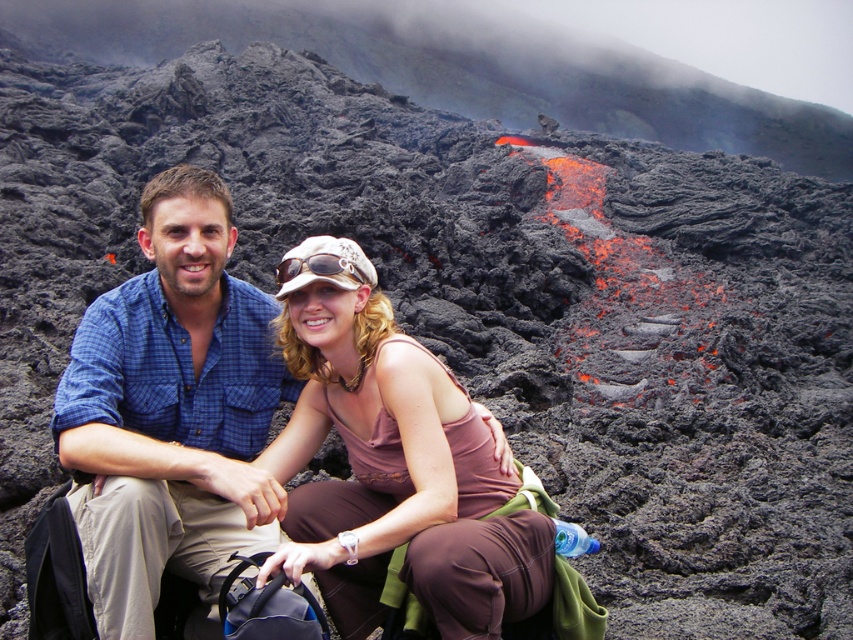
Does blue plaid shirt at center appear on the right side of pink fabric at center?

Incorrect, blue plaid shirt at center is not on the right side of pink fabric at center.

Describe the element at coordinates (172, 413) in the screenshot. I see `blue plaid shirt at center` at that location.

Between point (103, 620) and point (273, 563), which one is positioned behind?

Point (273, 563)

The height and width of the screenshot is (640, 853). In order to click on blue plaid shirt at center in this screenshot , I will do `click(172, 413)`.